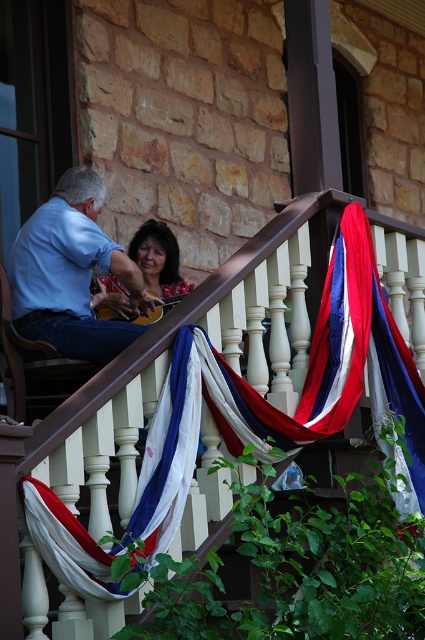
You are a photographer standing on the porch and want to capture a photo that includes both the white wood railing at upper center and the matte black hair at upper center. Given their distance apart, is it possible to frame both in a single shot without moving either object?

The white wood railing at upper center and the matte black hair at upper center are 31.54 feet apart. Depending on the camera lens and framing, it might be challenging to capture both in a single shot without moving them, as 31.54 feet is a considerable distance. A wide angle lens could potentially include both, but the photographer would need to position themselves appropriately to ensure both elements are within the frame.

You are a photographer standing on the porch and want to take a photo of the man playing the guitar. The camera you are using has a depth of field that can only focus on objects at the same distance. Since the blue denim jeans at left and the matte black hair at upper center are at different distances, which one is closer to you so that you can focus on it properly?

The blue denim jeans at left is in front of matte black hair at upper center, so it is closer to you. Therefore, the camera will focus on the blue denim jeans at left properly while the matte black hair at upper center may be slightly out of focus.

You are standing on the porch and want to place a small potted plant between the two points marked as point (96, 531) and point (85, 336). Which point should the plant be closer to in order to be nearer to the camera?

The plant should be closer to point (96, 531) because it is nearer to the camera compared to point (85, 336).